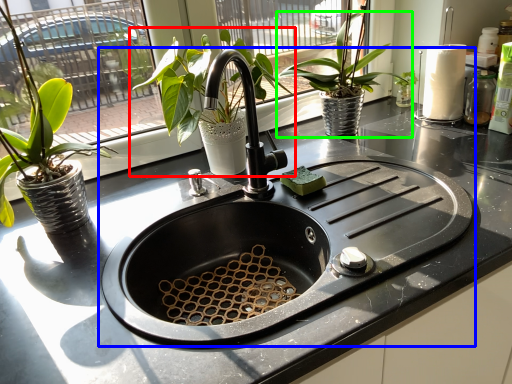
Question: Which is farther away from houseplant (highlighted by a red box)? sink (highlighted by a blue box) or houseplant (highlighted by a green box)?

Choices:
 (A) sink
 (B) houseplant

Answer: (B)